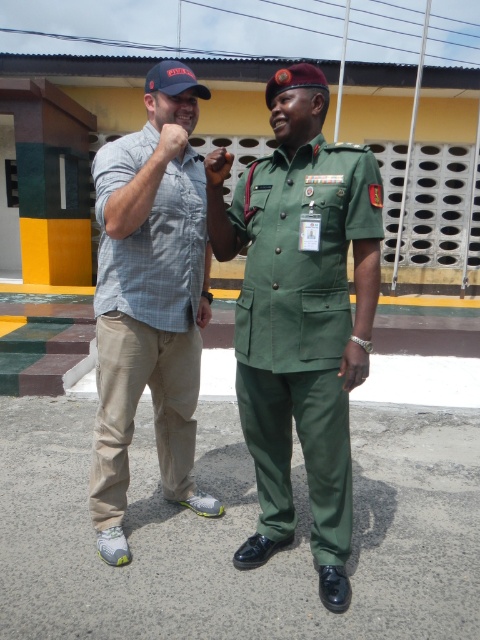
You are a photographer trying to capture a closeup of the medals on the military uniform. You notice a point at coordinates [300,326] in the image. Based on the scene, can you determine if this point is located on the medals or somewhere else on the uniform?

The point at coordinates [300,326] is on the green fabric uniform at center, so it is not on the medals but on the uniform itself.

You are a security guard at the building with a yellow facade and dark roof. You notice two people outside. One has light brown cotton pants at left and the other has a matte black watch at upper center. Which object is lower in position?

The light brown cotton pants at left is located below the matte black watch at upper center, so the light brown cotton pants at left is lower in position.

You are a photographer trying to capture a group photo of the two people in the image. You need to arrange them so that the green fabric uniform at center is positioned to the right of the light brown cotton pants at left. Is this already the case in the current arrangement?

Yes, the green fabric uniform at center is already positioned to the right of the light brown cotton pants at left as described.